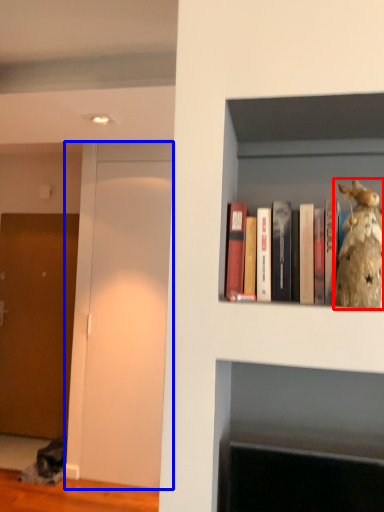
Question: Which point is closer to the camera, figurine (highlighted by a red box) or glass door (highlighted by a blue box)?

Choices:
 (A) figurine
 (B) glass door

Answer: (A)